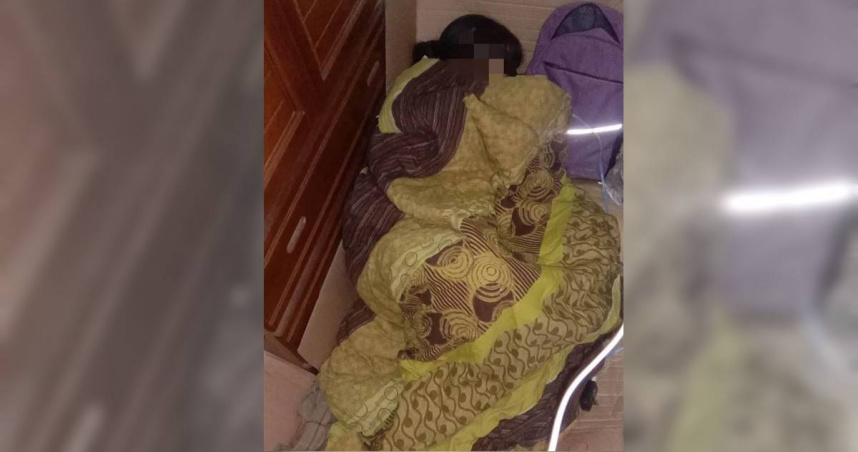
Find the location of a particular element. This screenshot has width=858, height=452. mattress is located at coordinates (593, 430).